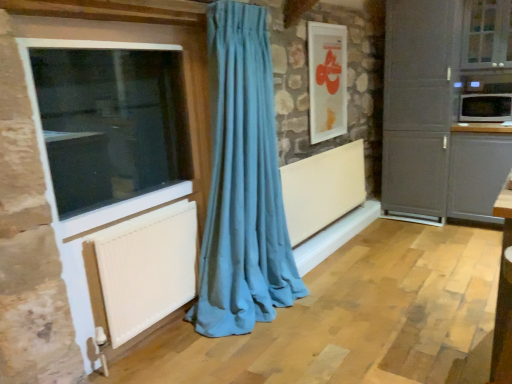
Question: Could you tell me if white textured radiator at lower left, marked as the second radiator in a right-to-left arrangement, is turned towards white glossy picture frame at upper center?

Choices:
 (A) no
 (B) yes

Answer: (A)

Question: From a real-world perspective, is white textured radiator at lower left, which is the first radiator from front to back, over white glossy picture frame at upper center?

Choices:
 (A) no
 (B) yes

Answer: (A)

Question: Does white textured radiator at lower left, marked as the second radiator in a right-to-left arrangement, appear on the right side of white glossy picture frame at upper center?

Choices:
 (A) no
 (B) yes

Answer: (A)

Question: Can you confirm if white textured radiator at lower left, marked as the second radiator in a back-to-front arrangement, is thinner than white glossy picture frame at upper center?

Choices:
 (A) no
 (B) yes

Answer: (B)

Question: Can you confirm if white textured radiator at lower left, marked as the second radiator in a right-to-left arrangement, is shorter than white glossy picture frame at upper center?

Choices:
 (A) no
 (B) yes

Answer: (B)

Question: Considering the positions of point (314, 215) and point (470, 157), is point (314, 215) closer or farther from the camera than point (470, 157)?

Choices:
 (A) closer
 (B) farther

Answer: (A)

Question: Considering their positions, is white matte radiator at center, marked as the second radiator in a front-to-back arrangement, located in front of or behind matte gray cabinet at right, acting as the 1th cabinetry starting from the left?

Choices:
 (A) behind
 (B) front

Answer: (B)

Question: Is white matte radiator at center, placed as the first radiator when sorted from right to left, spatially inside matte gray cabinet at right, acting as the 1th cabinetry starting from the left, or outside of it?

Choices:
 (A) outside
 (B) inside

Answer: (A)

Question: From the image's perspective, relative to matte gray cabinet at right, arranged as the 2th cabinetry when viewed from the right, is white matte radiator at center, marked as the second radiator in a front-to-back arrangement, above or below?

Choices:
 (A) above
 (B) below

Answer: (B)

Question: Is white plastic window at left, positioned as the 1th window in left-to-right order, to the left or to the right of white matte radiator at center, marked as the second radiator in a front-to-back arrangement, in the image?

Choices:
 (A) left
 (B) right

Answer: (A)

Question: From the image's perspective, relative to white matte radiator at center, placed as the 2th radiator when sorted from left to right, is white plastic window at left, positioned as the 1th window in left-to-right order, above or below?

Choices:
 (A) above
 (B) below

Answer: (A)

Question: From a real-world perspective, is white plastic window at left, positioned as the 1th window in left-to-right order, physically located above or below white matte radiator at center, placed as the 2th radiator when sorted from left to right?

Choices:
 (A) above
 (B) below

Answer: (A)

Question: Is white plastic window at left, which is the 1th window in bottom-to-top order, wider or thinner than white matte radiator at center, placed as the first radiator when sorted from right to left?

Choices:
 (A) wide
 (B) thin

Answer: (B)

Question: Based on their positions, is teal fabric curtain at center located to the left or right of clear glass window at upper right, acting as the 1th window starting from the top?

Choices:
 (A) left
 (B) right

Answer: (A)

Question: Is teal fabric curtain at center taller or shorter than clear glass window at upper right, which appears as the 1th window when viewed from the back?

Choices:
 (A) short
 (B) tall

Answer: (B)